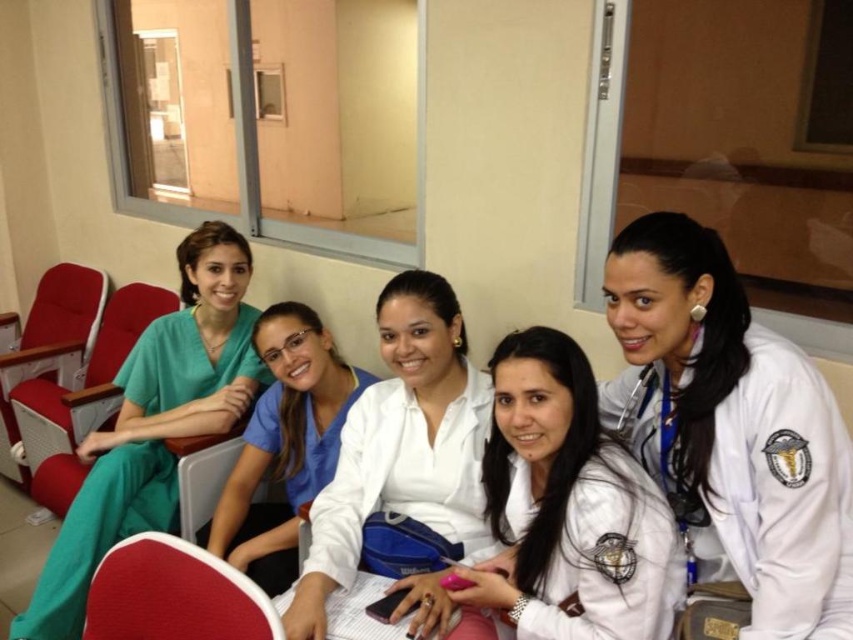
You are a healthcare worker in the same room and want to locate the white matte shirt at center. Where should you look?

You should look at point (567,506) to find the white matte shirt at center.

You are a healthcare worker standing 5 feet away from the white matte shirt at center in the image. Can you safely approach and hand them a medical report without entering their personal space? Please explain using the distance provided.

The white matte shirt at center is 4.29 feet away from the viewer. Since you are standing 5 feet away, you are slightly farther than the shirt. To hand them the report, you would need to move closer. Personal space is generally about 4 feet, so approaching to around 4.29 feet would be within their personal space. It is advisable to ask for permission before entering their space.